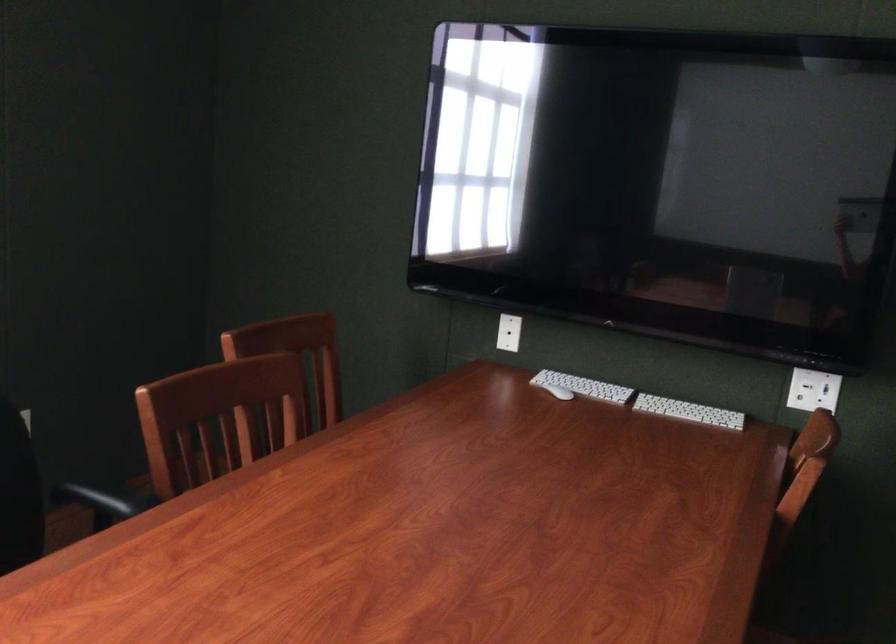
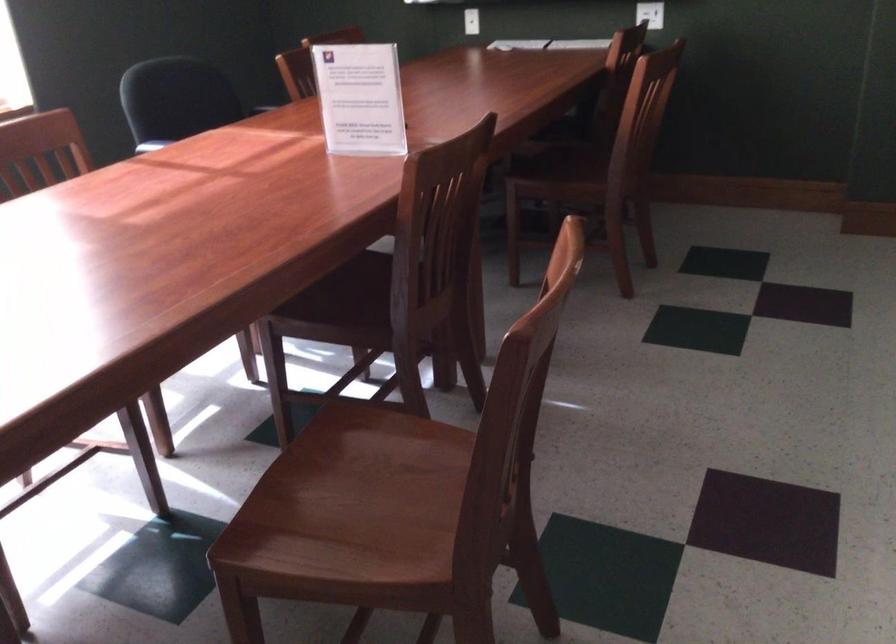
Locate, in the second image, the point that corresponds to point 512,341 in the first image.

(471, 21)